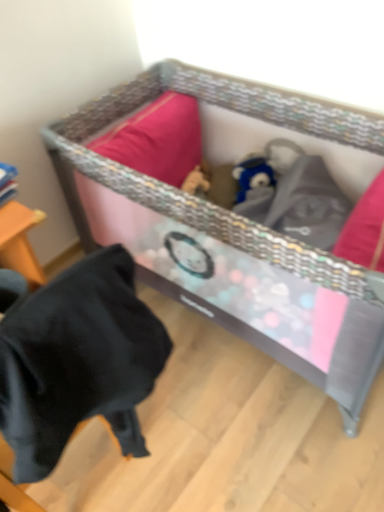
Identify the location of vacant space to the right of black fabric at lower left. (206, 429).